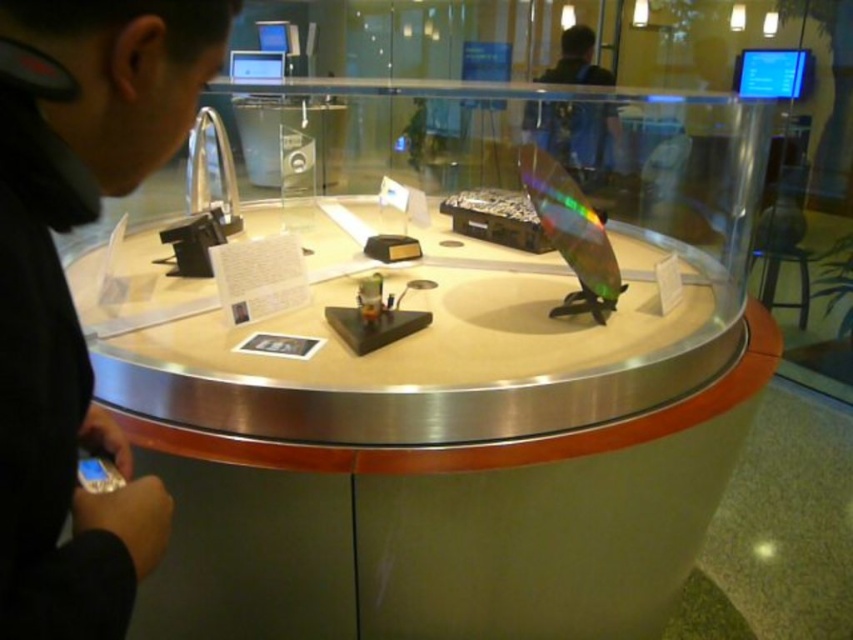
Question: Can you confirm if black matte phone at left is bigger than dark blue shirt at upper center?

Choices:
 (A) no
 (B) yes

Answer: (A)

Question: Estimate the real-world distances between objects in this image. Which object is farther from the black matte phone at left?

Choices:
 (A) matte silver table at center
 (B) dark blue shirt at upper center

Answer: (B)

Question: Which object is closer to the camera taking this photo?

Choices:
 (A) dark blue shirt at upper center
 (B) matte silver table at center
 (C) black matte phone at left

Answer: (C)

Question: Which point is closer to the camera?

Choices:
 (A) matte silver table at center
 (B) black matte phone at left

Answer: (B)

Question: Can you confirm if matte silver table at center is positioned below dark blue shirt at upper center?

Choices:
 (A) no
 (B) yes

Answer: (B)

Question: Is black matte phone at left above dark blue shirt at upper center?

Choices:
 (A) yes
 (B) no

Answer: (B)